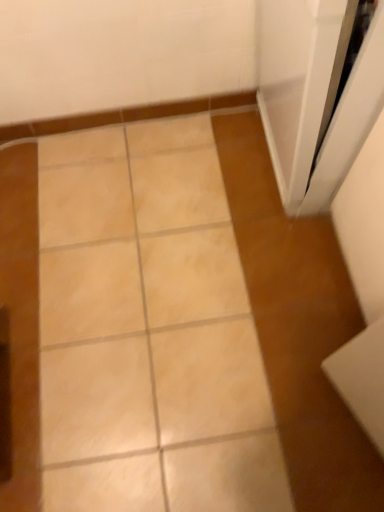
Question: From the image's perspective, is white glossy screen door at upper right over beige glossy tile at center?

Choices:
 (A) no
 (B) yes

Answer: (B)

Question: Is white glossy screen door at upper right located outside beige glossy tile at center?

Choices:
 (A) no
 (B) yes

Answer: (B)

Question: Does white glossy screen door at upper right have a lesser height compared to beige glossy tile at center?

Choices:
 (A) yes
 (B) no

Answer: (B)

Question: From a real-world perspective, does white glossy screen door at upper right stand above beige glossy tile at center?

Choices:
 (A) no
 (B) yes

Answer: (B)

Question: Is white glossy screen door at upper right bigger than beige glossy tile at center?

Choices:
 (A) yes
 (B) no

Answer: (A)

Question: Is white glossy screen door at upper right to the right of beige glossy tile at center from the viewer's perspective?

Choices:
 (A) no
 (B) yes

Answer: (B)

Question: From a real-world perspective, is beige glossy tile at center beneath white glossy screen door at upper right?

Choices:
 (A) yes
 (B) no

Answer: (A)

Question: Considering the relative positions of beige glossy tile at center and white glossy screen door at upper right in the image provided, is beige glossy tile at center to the right of white glossy screen door at upper right from the viewer's perspective?

Choices:
 (A) yes
 (B) no

Answer: (B)

Question: Is beige glossy tile at center oriented towards white glossy screen door at upper right?

Choices:
 (A) yes
 (B) no

Answer: (B)

Question: Considering the relative sizes of beige glossy tile at center and white glossy screen door at upper right in the image provided, is beige glossy tile at center thinner than white glossy screen door at upper right?

Choices:
 (A) yes
 (B) no

Answer: (B)

Question: From the image's perspective, is beige glossy tile at center under white glossy screen door at upper right?

Choices:
 (A) yes
 (B) no

Answer: (A)

Question: From the image's perspective, is beige glossy tile at center located above white glossy screen door at upper right?

Choices:
 (A) yes
 (B) no

Answer: (B)

Question: Does point (380, 10) appear closer or farther from the camera than point (241, 355)?

Choices:
 (A) closer
 (B) farther

Answer: (A)